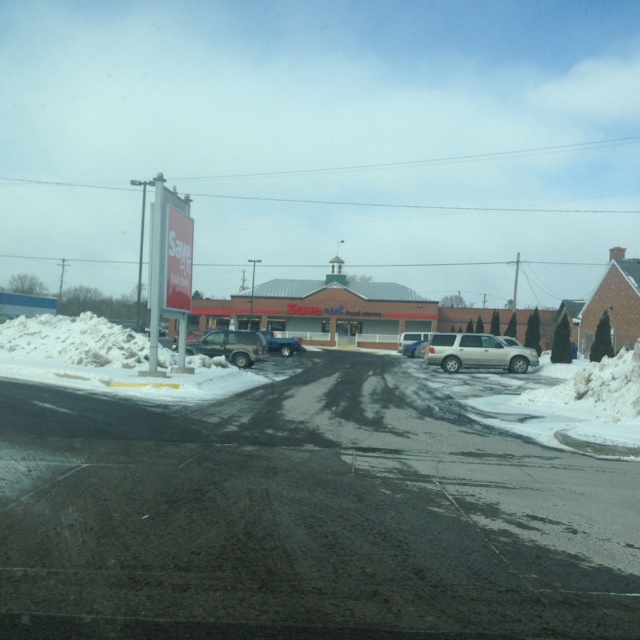
Question: Which object is closer to the camera taking this photo?

Choices:
 (A) blue matte truck at center
 (B) satin silver suv at center
 (C) silver metallic suv at center
 (D) silver metallic suv at center-right

Answer: (C)

Question: Does silver metallic suv at center-right have a larger size compared to blue matte truck at center?

Choices:
 (A) no
 (B) yes

Answer: (A)

Question: Does blue matte truck at center lie behind satin silver suv at center?

Choices:
 (A) no
 (B) yes

Answer: (A)

Question: Which of the following is the closest to the observer?

Choices:
 (A) silver metallic suv at center
 (B) silver metallic suv at center-right
 (C) satin silver suv at center
 (D) blue matte truck at center

Answer: (A)

Question: Which of these objects is positioned closest to the satin silver suv at center?

Choices:
 (A) silver metallic suv at center-right
 (B) blue matte truck at center
 (C) silver metallic suv at center

Answer: (B)

Question: From the image, what is the correct spatial relationship of blue matte truck at center in relation to satin silver suv at center?

Choices:
 (A) right
 (B) left

Answer: (B)